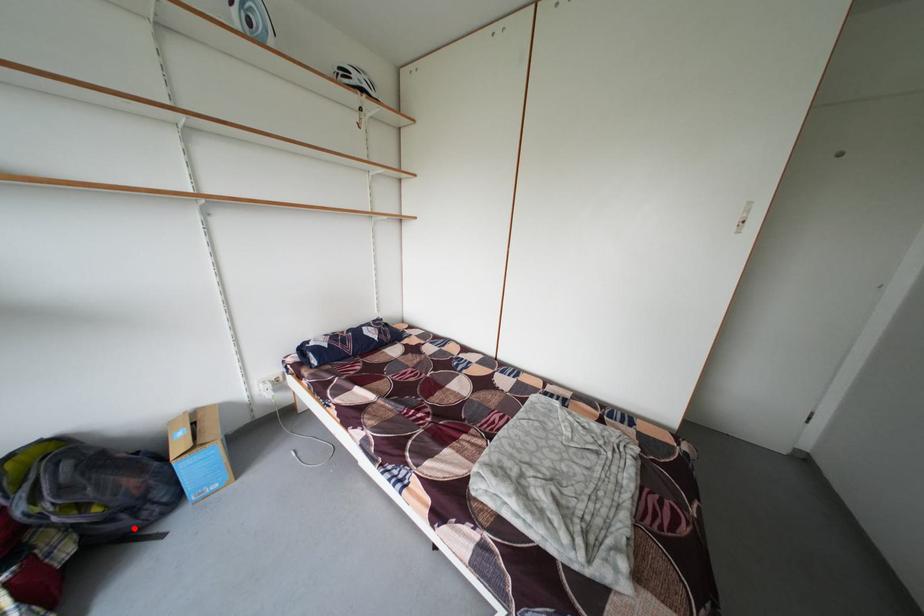
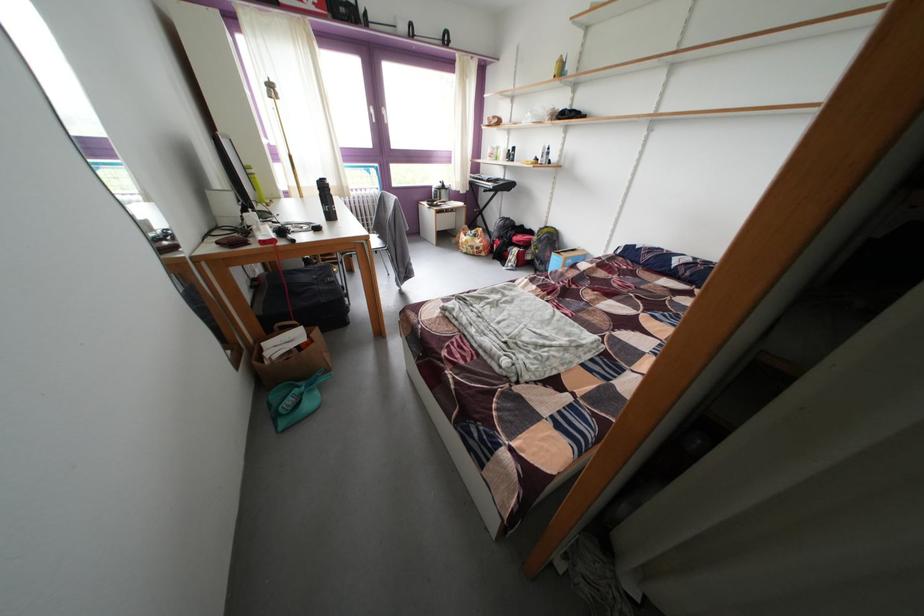
In the second image, find the point that corresponds to the highlighted location in the first image.

(548, 269)